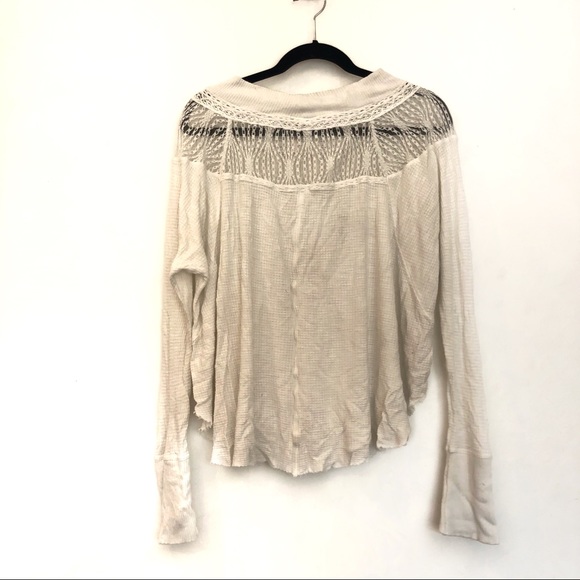
At what (x,y) coordinates should I click in order to perform the action: click on lace. Please return your answer as a coordinate pair (x, y). The height and width of the screenshot is (580, 580). Looking at the image, I should click on (307, 159).